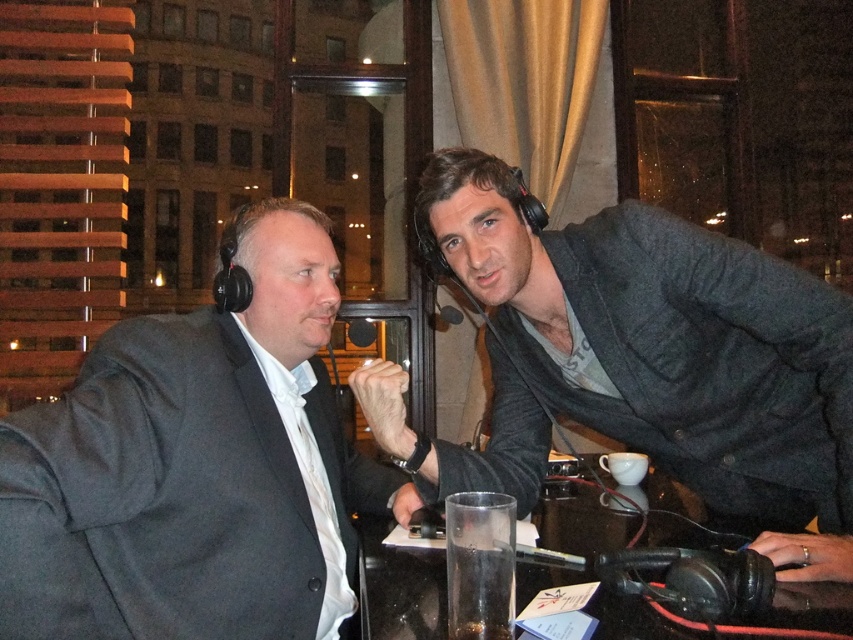
What do you see at coordinates (399, 586) in the screenshot?
I see `transparent glass at center` at bounding box center [399, 586].

Identify the location of transparent glass at center. (399, 586).

Where is `transparent glass at center`? This screenshot has width=853, height=640. transparent glass at center is located at coordinates (399, 586).

Is point (32, 616) positioned before point (521, 349)?

Yes, it is in front of point (521, 349).

This screenshot has width=853, height=640. What do you see at coordinates (195, 468) in the screenshot? I see `matte black suit at left` at bounding box center [195, 468].

Find the location of a particular element. matte black suit at left is located at coordinates (195, 468).

Does matte black suit at left appear on the left side of transparent glass at center?

Indeed, matte black suit at left is positioned on the left side of transparent glass at center.

Which of these two, matte black suit at left or transparent glass at center, stands shorter?

transparent glass at center is shorter.

Between point (120, 595) and point (430, 616), which one is positioned in front?

Point (430, 616) is more forward.

I want to click on matte black suit at left, so click(x=195, y=468).